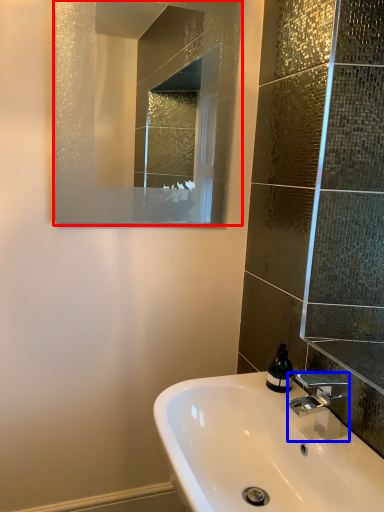
Question: Which point is closer to the camera, mirror (highlighted by a red box) or tap (highlighted by a blue box)?

Choices:
 (A) mirror
 (B) tap

Answer: (B)